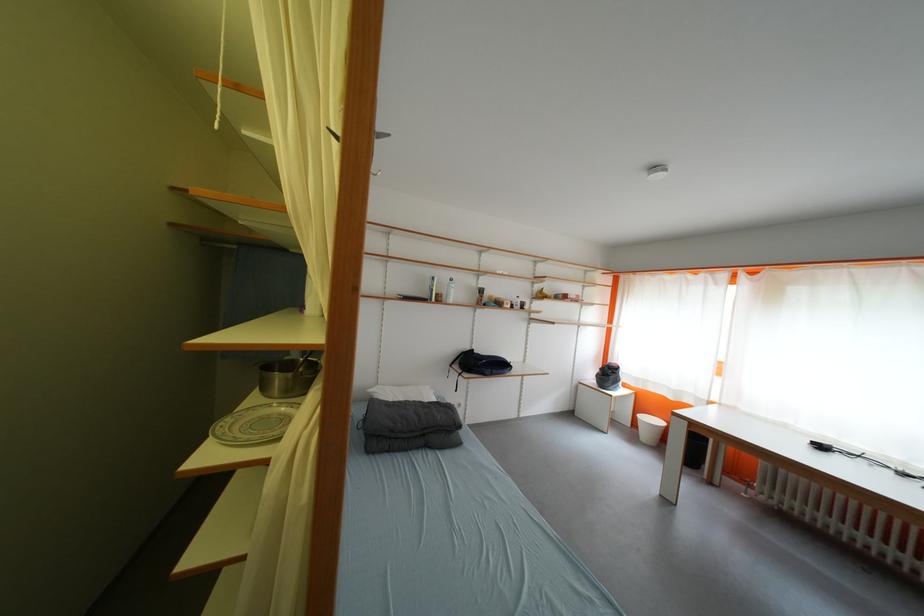
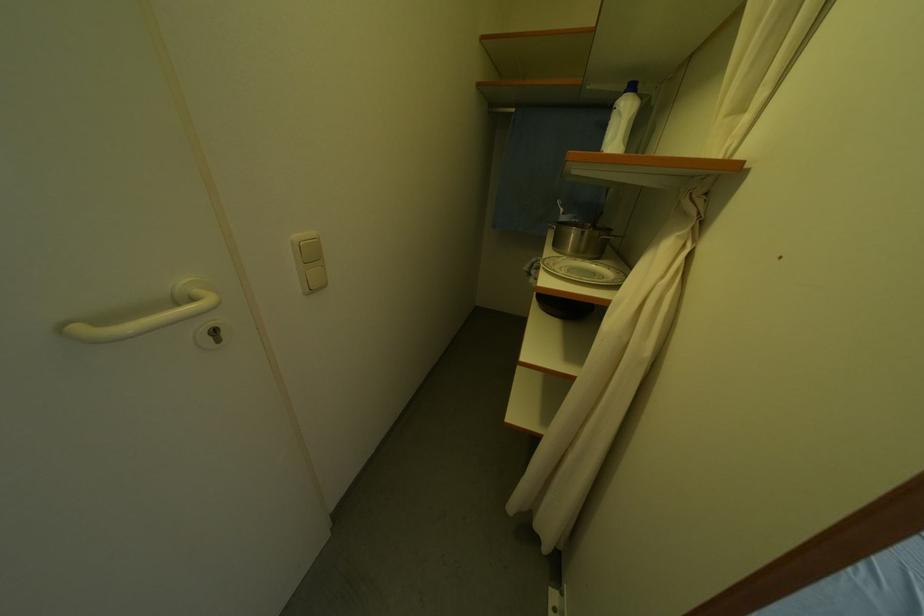
The point at (314, 363) is marked in the first image. Where is the corresponding point in the second image?

(602, 228)